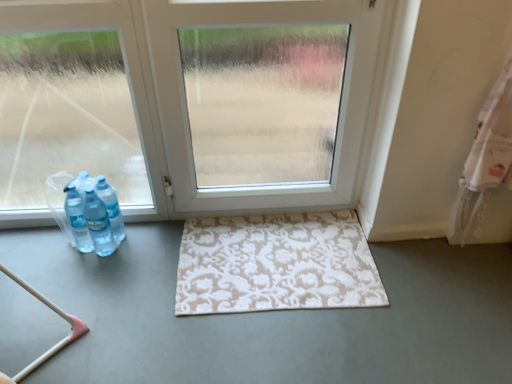
Locate an element on the screen. vacant point above beige patterned rug at center (from a real-world perspective) is located at coordinates (277, 258).